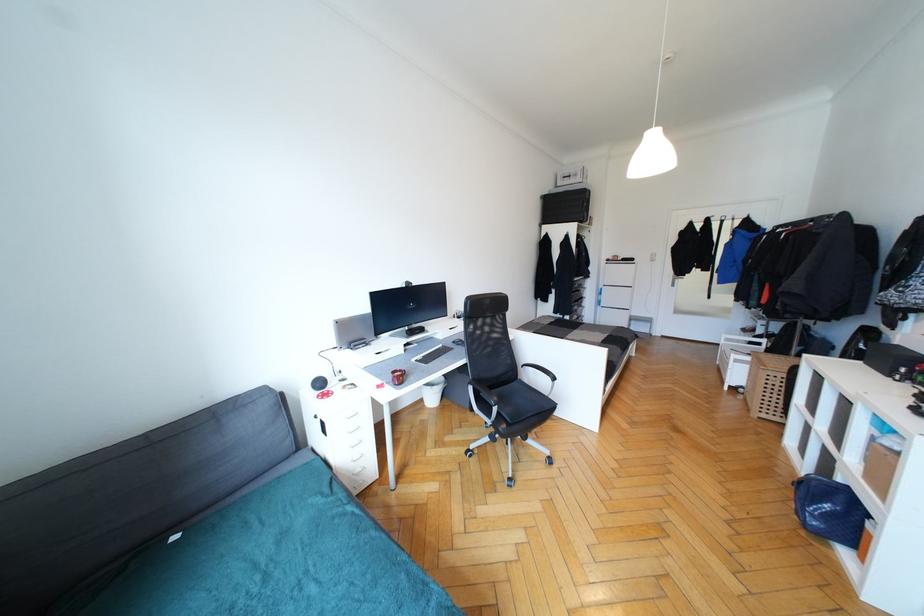
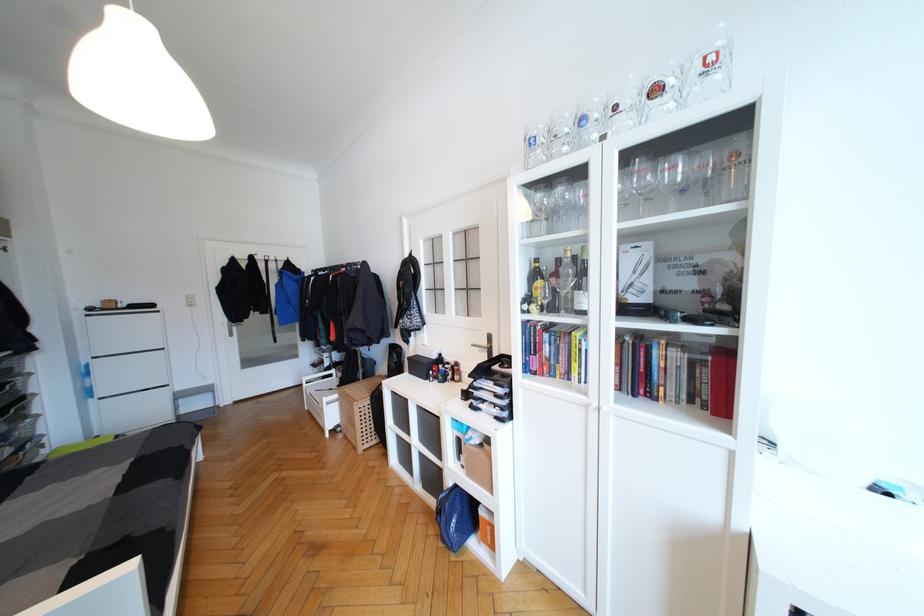
Locate, in the second image, the point that corresponds to [845,499] in the first image.

(460, 501)